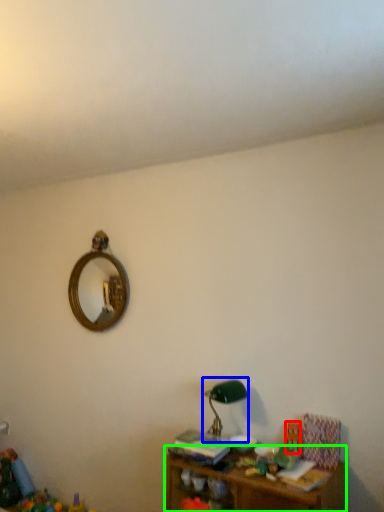
Question: Which is nearer to the toy (highlighted by a red box)? table lamp (highlighted by a blue box) or shelf (highlighted by a green box).

Choices:
 (A) table lamp
 (B) shelf

Answer: (A)